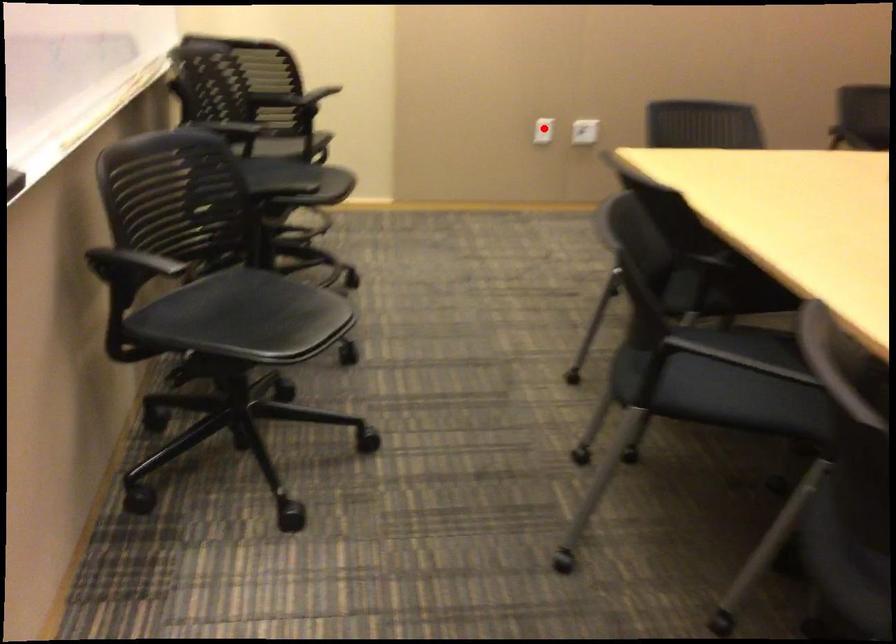
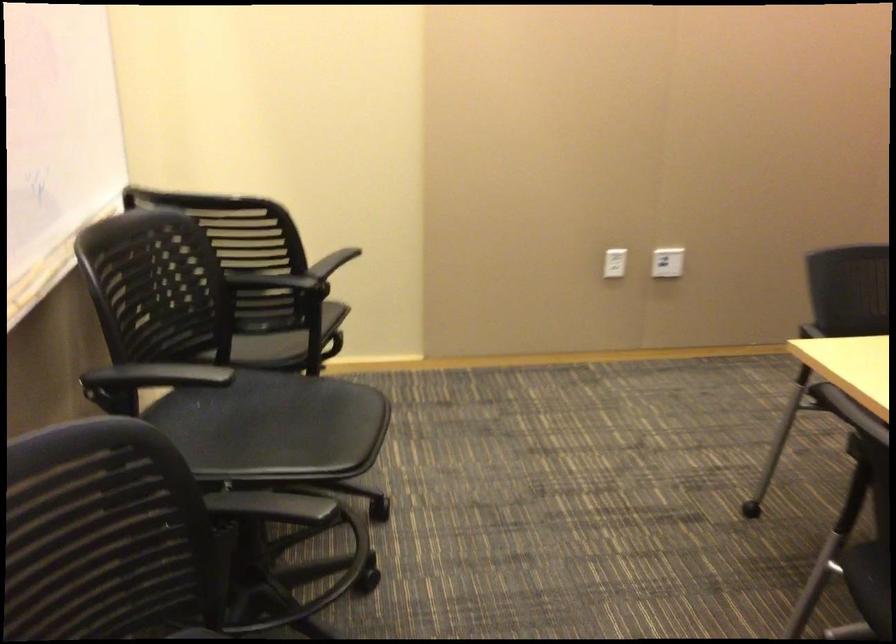
In the second image, find the point that corresponds to the highlighted location in the first image.

(615, 263)